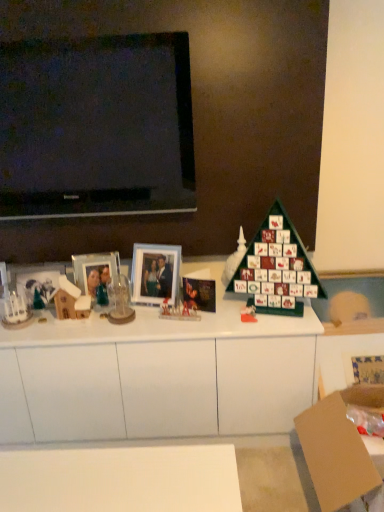
Find the location of a particular element. The width and height of the screenshot is (384, 512). vacant space in front of green matte advent calendar at right is located at coordinates (274, 324).